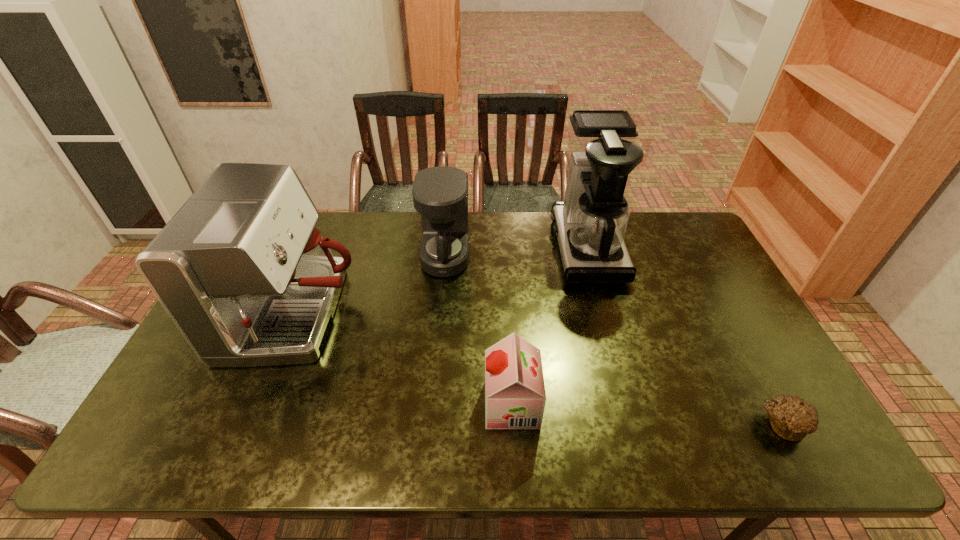
I want to click on vacant area that lies between the third object from right to left and the rightmost object, so click(x=647, y=414).

Locate an element on the screen. The height and width of the screenshot is (540, 960). vacant area that lies between the second shortest object and the muffin is located at coordinates (647, 414).

Locate an element on the screen. This screenshot has width=960, height=540. free space between the rightmost object and the fourth tallest object is located at coordinates (647, 414).

The height and width of the screenshot is (540, 960). Find the location of `vacant area that lies between the shortest coffee maker and the fourth tallest object`. vacant area that lies between the shortest coffee maker and the fourth tallest object is located at coordinates (479, 330).

Where is `empty location between the fourth tallest object and the muffin`? empty location between the fourth tallest object and the muffin is located at coordinates (647, 414).

Identify the location of free space that is in between the second coffee maker from right to left and the rightmost coffee maker. (516, 252).

The width and height of the screenshot is (960, 540). Find the location of `vacant area between the rightmost object and the rightmost coffee maker`. vacant area between the rightmost object and the rightmost coffee maker is located at coordinates (685, 336).

Locate which object ranks in proximity to the rightmost coffee maker. Please provide its 2D coordinates. Your answer should be formatted as a tuple, i.e. [(x, y)], where the tuple contains the x and y coordinates of a point satisfying the conditions above.

[(440, 194)]

Select which object is the second closest to the rightmost coffee maker. Please provide its 2D coordinates. Your answer should be formatted as a tuple, i.e. [(x, y)], where the tuple contains the x and y coordinates of a point satisfying the conditions above.

[(515, 397)]

Where is `the closest coffee maker to the leftmost coffee maker`? This screenshot has width=960, height=540. the closest coffee maker to the leftmost coffee maker is located at coordinates (440, 194).